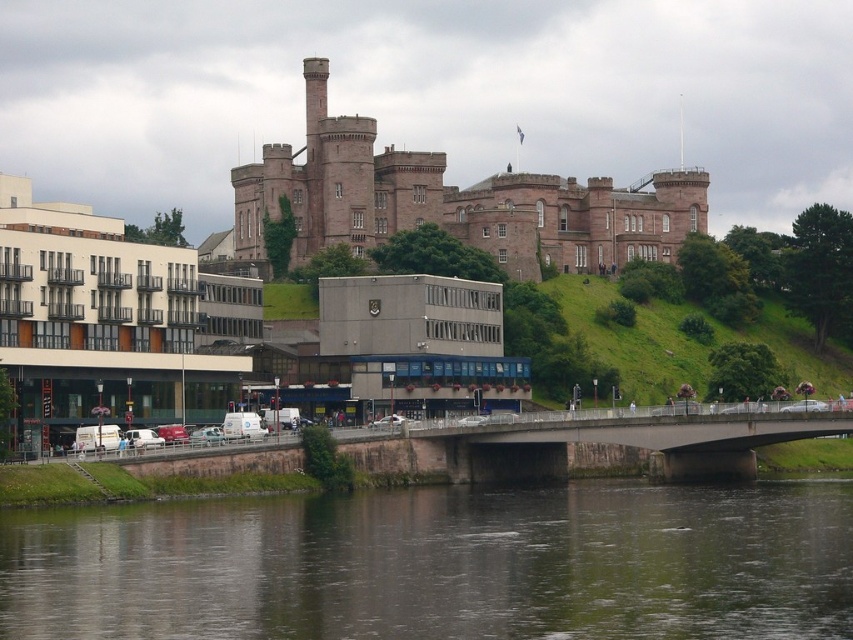
Identify the location of dark gray water at lower center. (440, 564).

Where is `dark gray water at lower center`? dark gray water at lower center is located at coordinates (440, 564).